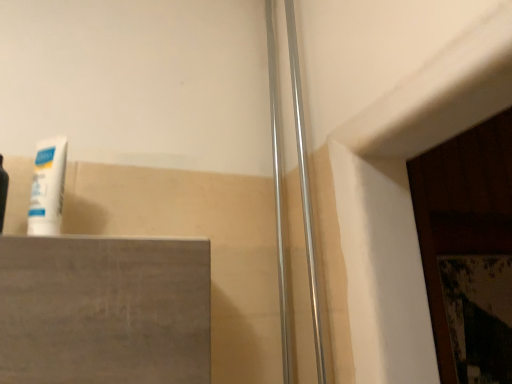
Where is `white matte tube at left`? white matte tube at left is located at coordinates (48, 187).

What do you see at coordinates (48, 187) in the screenshot?
I see `white matte tube at left` at bounding box center [48, 187].

Where is `satin silver shower door at center`? The image size is (512, 384). satin silver shower door at center is located at coordinates (306, 195).

What do you see at coordinates (306, 195) in the screenshot? I see `satin silver shower door at center` at bounding box center [306, 195].

Image resolution: width=512 pixels, height=384 pixels. I want to click on white matte tube at left, so click(x=48, y=187).

Would you say satin silver shower door at center is to the left or to the right of white matte tube at left in the picture?

Based on their positions, satin silver shower door at center is located to the right of white matte tube at left.

Considering the positions of objects satin silver shower door at center and white matte tube at left in the image provided, who is in front, satin silver shower door at center or white matte tube at left?

white matte tube at left is more forward.

Does point (282, 230) appear closer or farther from the camera than point (49, 215)?

Clearly, point (282, 230) is more distant from the camera than point (49, 215).

From the image's perspective, is satin silver shower door at center located above or below white matte tube at left?

satin silver shower door at center is above white matte tube at left.

From a real-world perspective, is satin silver shower door at center above or below white matte tube at left?

In terms of real-world spatial position, satin silver shower door at center is above white matte tube at left.

Is satin silver shower door at center thinner than white matte tube at left?

Indeed, satin silver shower door at center has a lesser width compared to white matte tube at left.

Consider the image. Does satin silver shower door at center have a lesser height compared to white matte tube at left?

No, satin silver shower door at center is not shorter than white matte tube at left.

Which of these two, satin silver shower door at center or white matte tube at left, is smaller?

satin silver shower door at center.

Which is correct: satin silver shower door at center is inside white matte tube at left, or outside of it?

satin silver shower door at center cannot be found inside white matte tube at left.

Is satin silver shower door at center far from white matte tube at left?

No, there isn't a large distance between satin silver shower door at center and white matte tube at left.

Is satin silver shower door at center positioned with its back to white matte tube at left?

satin silver shower door at center is not turned away from white matte tube at left.

Based on the photo, can you tell me how much satin silver shower door at center and white matte tube at left differ in facing direction?

The angle between the facing direction of satin silver shower door at center and the facing direction of white matte tube at left is 84 degrees.

Identify the location of shower door above the white matte tube at left (from a real-world perspective). The width and height of the screenshot is (512, 384). (306, 195).

Does white matte tube at left appear on the right side of satin silver shower door at center?

No, white matte tube at left is not to the right of satin silver shower door at center.

Relative to satin silver shower door at center, is white matte tube at left in front or behind?

white matte tube at left is positioned closer to the viewer than satin silver shower door at center.

Is point (40, 160) more distant than point (319, 366)?

No, it is in front of (319, 366).

From the image's perspective, is white matte tube at left located above or below satin silver shower door at center?

white matte tube at left is below satin silver shower door at center.

From a real-world perspective, which object rests below the other?

In real-world perspective, white matte tube at left is lower.

In terms of width, does white matte tube at left look wider or thinner when compared to satin silver shower door at center?

Clearly, white matte tube at left has more width compared to satin silver shower door at center.

Can you confirm if white matte tube at left is taller than satin silver shower door at center?

Incorrect, the height of white matte tube at left is not larger of that of satin silver shower door at center.

Considering the sizes of objects white matte tube at left and satin silver shower door at center in the image provided, who is smaller, white matte tube at left or satin silver shower door at center?

With smaller size is satin silver shower door at center.

Is white matte tube at left not within satin silver shower door at center?

Yes, white matte tube at left is located beyond the bounds of satin silver shower door at center.

Is white matte tube at left directly adjacent to satin silver shower door at center?

white matte tube at left and satin silver shower door at center are not in contact.

Is white matte tube at left looking in the opposite direction of satin silver shower door at center?

No, satin silver shower door at center is not at the back of white matte tube at left.

What's the angular difference between white matte tube at left and satin silver shower door at center's facing directions?

84 degrees.

How much distance is there between white matte tube at left and satin silver shower door at center?

white matte tube at left and satin silver shower door at center are 14.74 inches apart from each other.

The image size is (512, 384). What are the coordinates of `toothpaste on the left of satin silver shower door at center` in the screenshot? It's located at (48, 187).

Locate an element on the screen. shower door lying on the right of white matte tube at left is located at coordinates (306, 195).

Locate an element on the screen. The width and height of the screenshot is (512, 384). shower door above the white matte tube at left (from the image's perspective) is located at coordinates (306, 195).